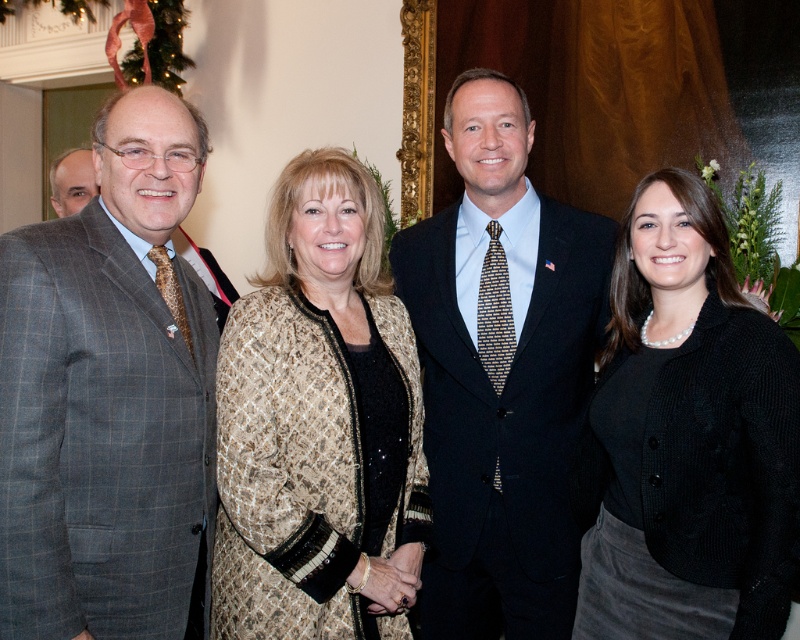
Is black wool cardigan at right below matte gray suit at left?

Correct, black wool cardigan at right is located below matte gray suit at left.

Is point (625, 611) less distant than point (60, 157)?

Yes, point (625, 611) is in front of point (60, 157).

Between point (682, 353) and point (82, 166), which one is positioned in front?

Positioned in front is point (682, 353).

Find the location of a particular element. black wool cardigan at right is located at coordinates (688, 436).

Who is positioned more to the left, dark blue suit at center or black wool cardigan at right?

dark blue suit at center is more to the left.

Which of these two, dark blue suit at center or black wool cardigan at right, stands taller?

With more height is dark blue suit at center.

The image size is (800, 640). I want to click on dark blue suit at center, so click(x=501, y=372).

This screenshot has width=800, height=640. In order to click on dark blue suit at center in this screenshot , I will do `click(501, 372)`.

Between gray checkered suit at left and matte gray suit at left, which one appears on the right side from the viewer's perspective?

From the viewer's perspective, gray checkered suit at left appears more on the right side.

Identify the location of gray checkered suit at left. (102, 417).

Who is more forward, (x=150, y=214) or (x=92, y=179)?

Point (x=150, y=214)

This screenshot has height=640, width=800. I want to click on gray checkered suit at left, so click(x=102, y=417).